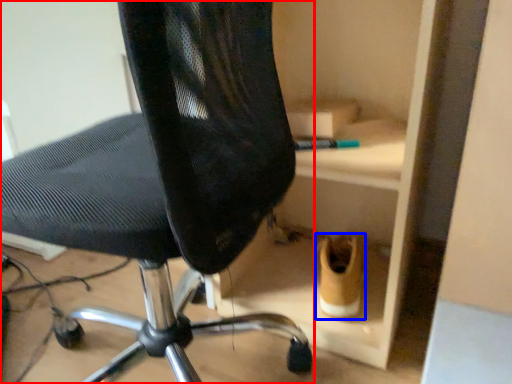
Question: Which of the following is the closest to the observer, chair (highlighted by a red box) or footwear (highlighted by a blue box)?

Choices:
 (A) chair
 (B) footwear

Answer: (A)